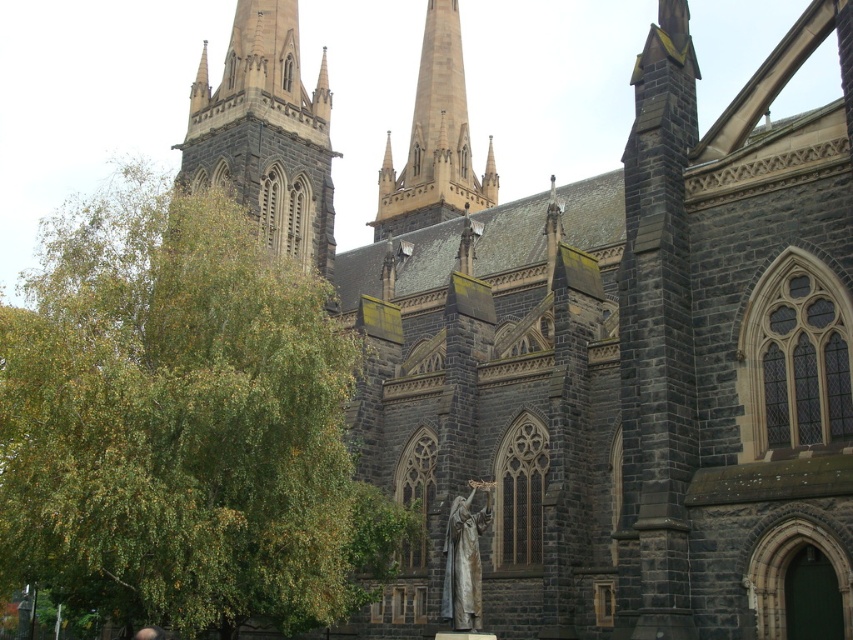
Question: Which point is closer to the camera?

Choices:
 (A) (84, 296)
 (B) (473, 579)
 (C) (444, 38)

Answer: (B)

Question: Is dark gray stone tower at upper left to the left of bronze statue at center from the viewer's perspective?

Choices:
 (A) yes
 (B) no

Answer: (A)

Question: Among these objects, which one is farthest from the camera?

Choices:
 (A) light brown stone spire at upper center
 (B) green leafy tree at left

Answer: (A)

Question: Estimate the real-world distances between objects in this image. Which object is farther from the green leafy tree at left?

Choices:
 (A) dark gray stone tower at upper left
 (B) light brown stone spire at upper center
 (C) bronze statue at center

Answer: (B)

Question: Does green leafy tree at left appear over dark gray stone tower at upper left?

Choices:
 (A) no
 (B) yes

Answer: (A)

Question: Does green leafy tree at left appear on the left side of light brown stone spire at upper center?

Choices:
 (A) yes
 (B) no

Answer: (A)